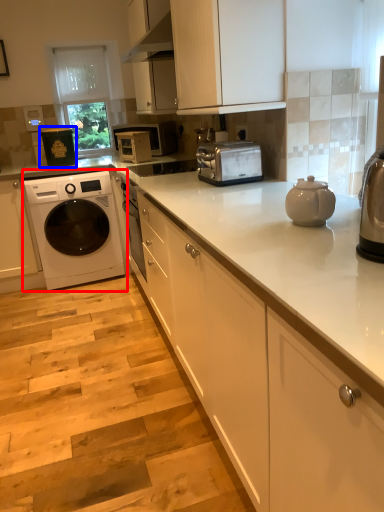
Question: Which of the following is the farthest to the observer, washing machine (highlighted by a red box) or appliance (highlighted by a blue box)?

Choices:
 (A) washing machine
 (B) appliance

Answer: (B)